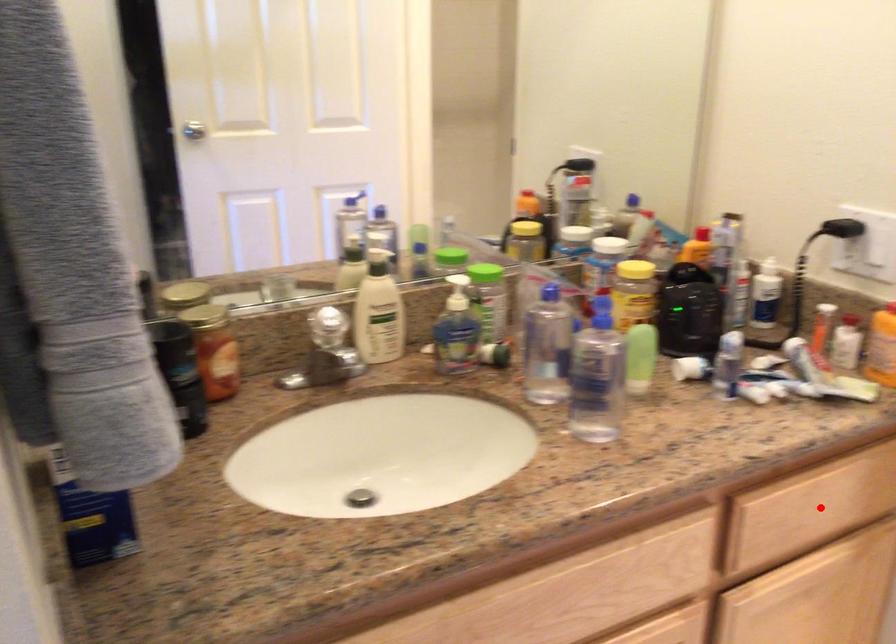
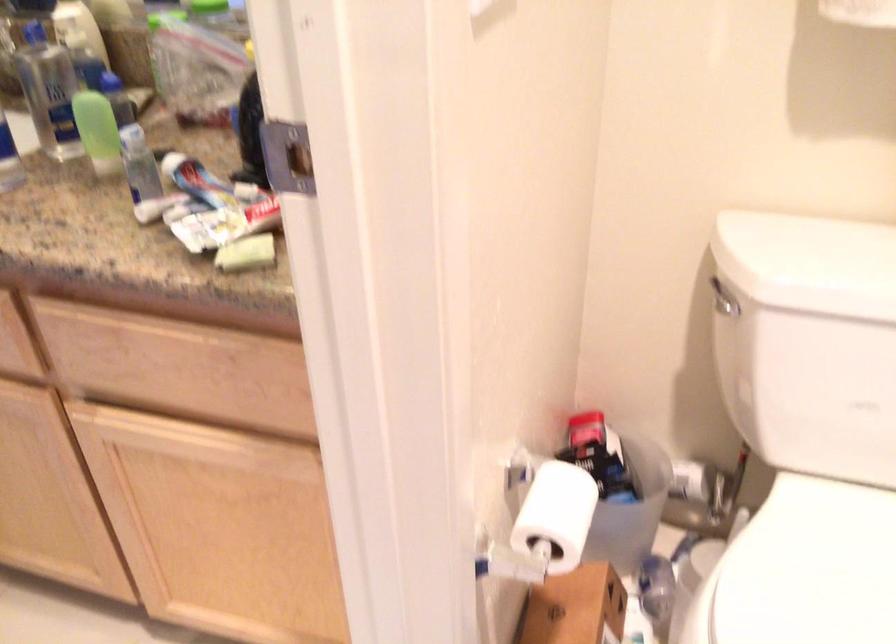
Question: I am providing you with two images of the same scene from different viewpoints. Image1 has a red point marked. In image2, the corresponding 3D location appears at what relative position? Reply with the corresponding letter.

Choices:
 (A) Closer
 (B) Farther

Answer: (A)